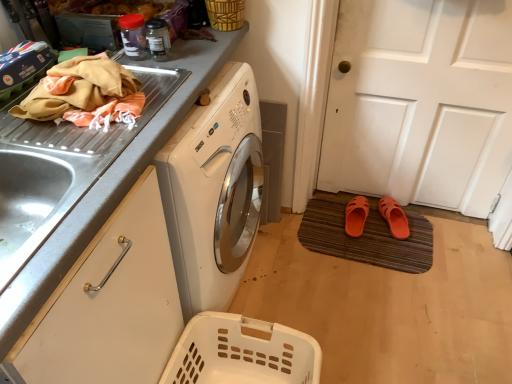
Locate an element on the screen. The height and width of the screenshot is (384, 512). empty space that is to the right of brown textured doormat at lower right is located at coordinates (463, 255).